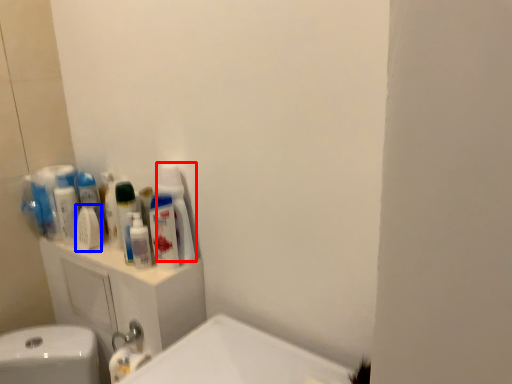
Question: Which of the following is the closest to the observer, cleaning product (highlighted by a red box) or mouthwash (highlighted by a blue box)?

Choices:
 (A) cleaning product
 (B) mouthwash

Answer: (A)